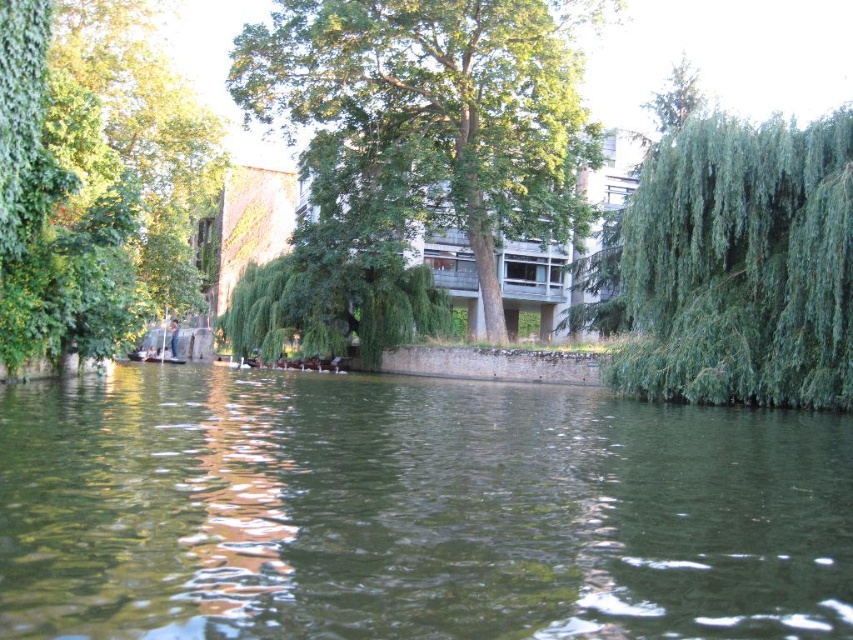
Is point (113, 516) less distant than point (561, 118)?

Yes, it is in front of point (561, 118).

Is greenish water at center smaller than green leafy tree at center?

Yes, greenish water at center is smaller than green leafy tree at center.

Find the location of a particular element. This screenshot has height=640, width=853. greenish water at center is located at coordinates (412, 512).

Image resolution: width=853 pixels, height=640 pixels. In order to click on greenish water at center in this screenshot , I will do `click(412, 512)`.

The width and height of the screenshot is (853, 640). I want to click on green leafy tree at center, so click(x=442, y=106).

Is green leafy tree at center below green leafy willow at center?

No.

Is point (366, 51) farther from viewer compared to point (444, 317)?

No, (366, 51) is closer to viewer.

This screenshot has height=640, width=853. What are the coordinates of `green leafy tree at center` in the screenshot? It's located at (442, 106).

Does green leafy tree at center have a lesser height compared to green leafy willow at right?

No.

Who is shorter, green leafy tree at center or green leafy willow at right?

With less height is green leafy willow at right.

Which is behind, point (421, 6) or point (827, 225)?

The point (421, 6) is behind.

Find the location of a particular element. The height and width of the screenshot is (640, 853). green leafy tree at center is located at coordinates (442, 106).